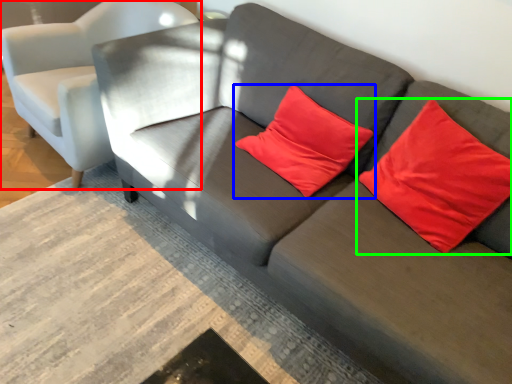
Question: Which object is positioned closest to chair (highlighted by a red box)? Select from pillow (highlighted by a blue box) and pillow (highlighted by a green box).

Choices:
 (A) pillow
 (B) pillow

Answer: (A)